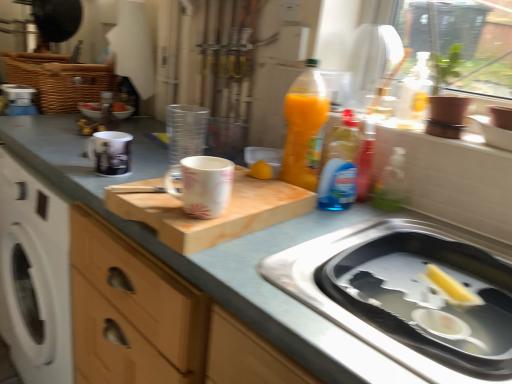
You are a GUI agent. You are given a task and a screenshot of the screen. Output one action in this format:
    pyautogui.click(x=<x>, y=<y>)
    Task: Click on the vacant space in front of metallic silver bottle at upper center, the 2th bottle from the right
    This screenshot has height=384, width=512.
    Given the screenshot: What is the action you would take?
    pyautogui.click(x=94, y=127)